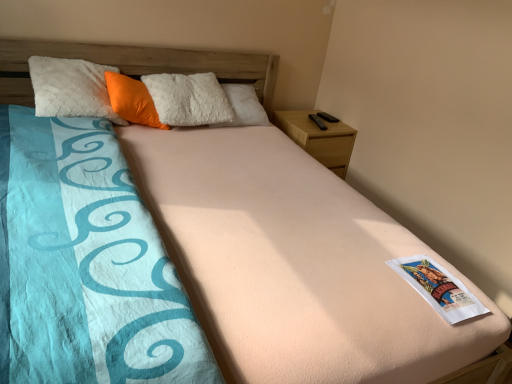
Question: Should I look upward or downward to see white paper at center?

Choices:
 (A) up
 (B) down

Answer: (B)

Question: Is wooden nightstand at upper right bigger than white paper at center?

Choices:
 (A) no
 (B) yes

Answer: (B)

Question: From a real-world perspective, is wooden nightstand at upper right beneath white paper at center?

Choices:
 (A) yes
 (B) no

Answer: (A)

Question: Is wooden nightstand at upper right facing away from white paper at center?

Choices:
 (A) no
 (B) yes

Answer: (A)

Question: Does wooden nightstand at upper right have a lesser height compared to white paper at center?

Choices:
 (A) no
 (B) yes

Answer: (A)

Question: Is wooden nightstand at upper right next to white paper at center?

Choices:
 (A) no
 (B) yes

Answer: (A)

Question: Can you confirm if wooden nightstand at upper right is positioned to the right of white paper at center?

Choices:
 (A) yes
 (B) no

Answer: (B)

Question: Considering the relative positions of wooden nightstand at upper right and orange plush pillow at upper left in the image provided, is wooden nightstand at upper right in front of orange plush pillow at upper left?

Choices:
 (A) yes
 (B) no

Answer: (B)

Question: Does wooden nightstand at upper right have a lesser width compared to orange plush pillow at upper left?

Choices:
 (A) yes
 (B) no

Answer: (B)

Question: Can you confirm if wooden nightstand at upper right is bigger than orange plush pillow at upper left?

Choices:
 (A) no
 (B) yes

Answer: (B)

Question: Is wooden nightstand at upper right wider than orange plush pillow at upper left?

Choices:
 (A) yes
 (B) no

Answer: (A)

Question: From a real-world perspective, is wooden nightstand at upper right under orange plush pillow at upper left?

Choices:
 (A) yes
 (B) no

Answer: (A)

Question: Could you tell me if wooden nightstand at upper right is turned towards orange plush pillow at upper left?

Choices:
 (A) yes
 (B) no

Answer: (B)

Question: Are white paper at center and wooden nightstand at upper right beside each other?

Choices:
 (A) no
 (B) yes

Answer: (A)